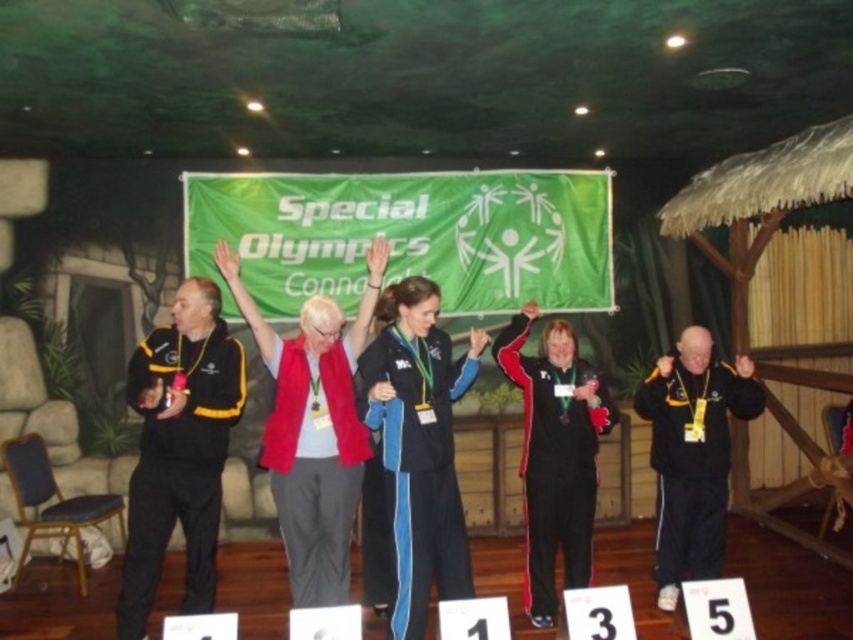
Question: Considering the real-world distances, which object is farthest from the black track suit at center?

Choices:
 (A) black fabric jacket at left
 (B) red fabric jacket at center
 (C) black matte jacket at right
 (D) blue track suit at center

Answer: (A)

Question: Does blue track suit at center come in front of black matte jacket at right?

Choices:
 (A) yes
 (B) no

Answer: (A)

Question: Which object is the farthest from the blue track suit at center?

Choices:
 (A) red fabric jacket at center
 (B) black fabric jacket at left
 (C) black track suit at center

Answer: (B)

Question: Which of these objects is positioned closest to the black matte jacket at right?

Choices:
 (A) red fabric jacket at center
 (B) black fabric jacket at left
 (C) black track suit at center

Answer: (C)

Question: Can you confirm if black fabric jacket at left is thinner than red fabric jacket at center?

Choices:
 (A) no
 (B) yes

Answer: (B)

Question: Can you confirm if black fabric jacket at left is wider than black track suit at center?

Choices:
 (A) no
 (B) yes

Answer: (A)